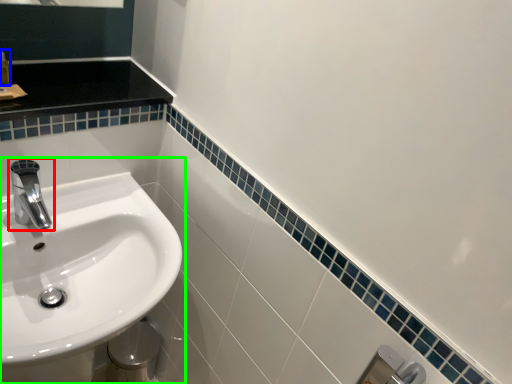
Question: Which object is positioned farthest from tap (highlighted by a red box)? Select from toiletry (highlighted by a blue box) and sink (highlighted by a green box).

Choices:
 (A) toiletry
 (B) sink

Answer: (A)